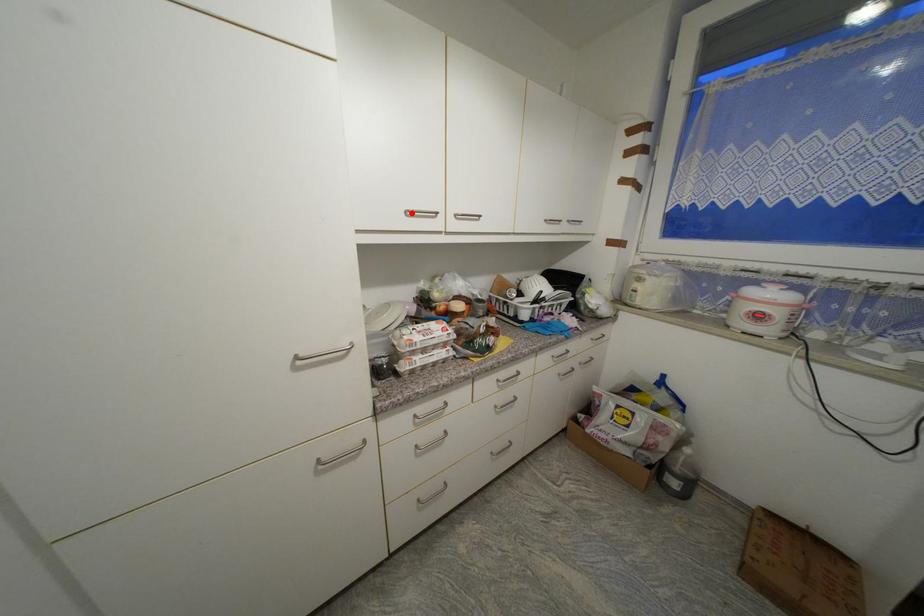
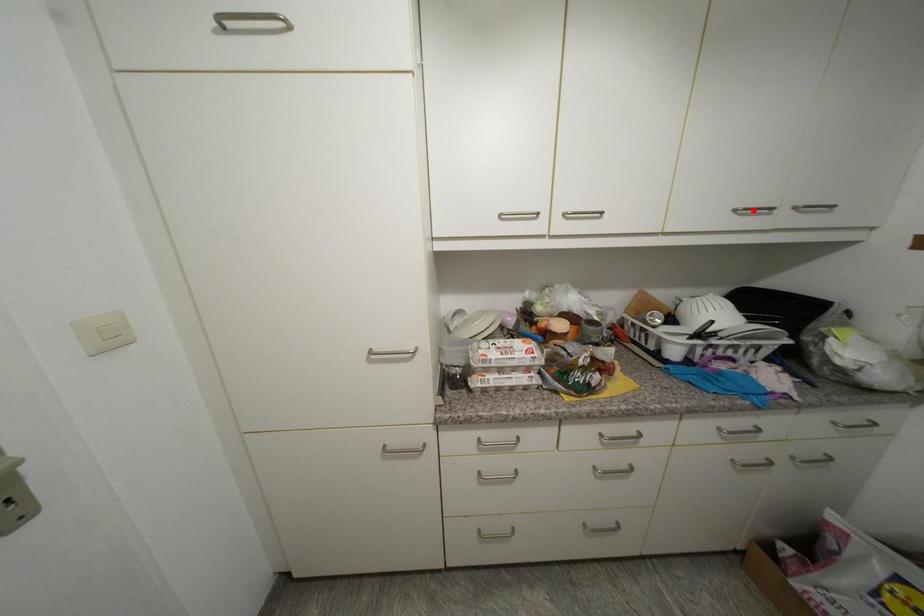
I am providing you with two images of the same scene from different viewpoints. A red point is marked on the first image and another point is marked on the second image. Do the highlighted points in image1 and image2 indicate the same real-world spot?

No